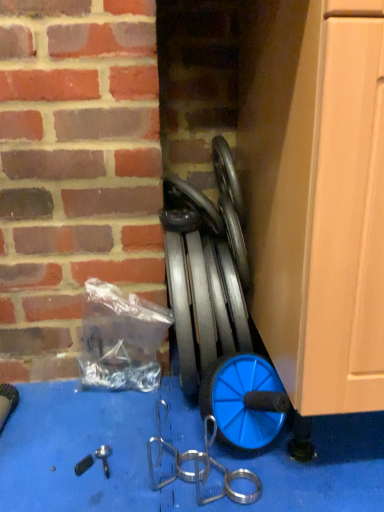
Question: Is blue rubber hose at center shorter than blue rubber wheel at center?

Choices:
 (A) no
 (B) yes

Answer: (A)

Question: From a real-world perspective, is blue rubber hose at center positioned under blue rubber wheel at center based on gravity?

Choices:
 (A) yes
 (B) no

Answer: (A)

Question: Are blue rubber hose at center and blue rubber wheel at center beside each other?

Choices:
 (A) no
 (B) yes

Answer: (A)

Question: From a real-world perspective, is blue rubber hose at center physically above blue rubber wheel at center?

Choices:
 (A) no
 (B) yes

Answer: (A)

Question: Is blue rubber hose at center closer to camera compared to blue rubber wheel at center?

Choices:
 (A) yes
 (B) no

Answer: (A)

Question: From the image's perspective, is blue rubber hose at center on top of blue rubber wheel at center?

Choices:
 (A) no
 (B) yes

Answer: (A)

Question: Does transparent plastic bag at center-left turn towards blue rubber wheel at center?

Choices:
 (A) no
 (B) yes

Answer: (A)

Question: Is there a large distance between transparent plastic bag at center-left and blue rubber wheel at center?

Choices:
 (A) yes
 (B) no

Answer: (B)

Question: Does transparent plastic bag at center-left have a greater height compared to blue rubber wheel at center?

Choices:
 (A) yes
 (B) no

Answer: (A)

Question: Considering the relative sizes of transparent plastic bag at center-left and blue rubber wheel at center in the image provided, is transparent plastic bag at center-left bigger than blue rubber wheel at center?

Choices:
 (A) no
 (B) yes

Answer: (B)

Question: Does transparent plastic bag at center-left have a lesser height compared to blue rubber wheel at center?

Choices:
 (A) yes
 (B) no

Answer: (B)

Question: Can you confirm if transparent plastic bag at center-left is thinner than blue rubber wheel at center?

Choices:
 (A) no
 (B) yes

Answer: (B)

Question: From the image's perspective, does blue rubber hose at center appear higher than transparent plastic bag at center-left?

Choices:
 (A) no
 (B) yes

Answer: (B)